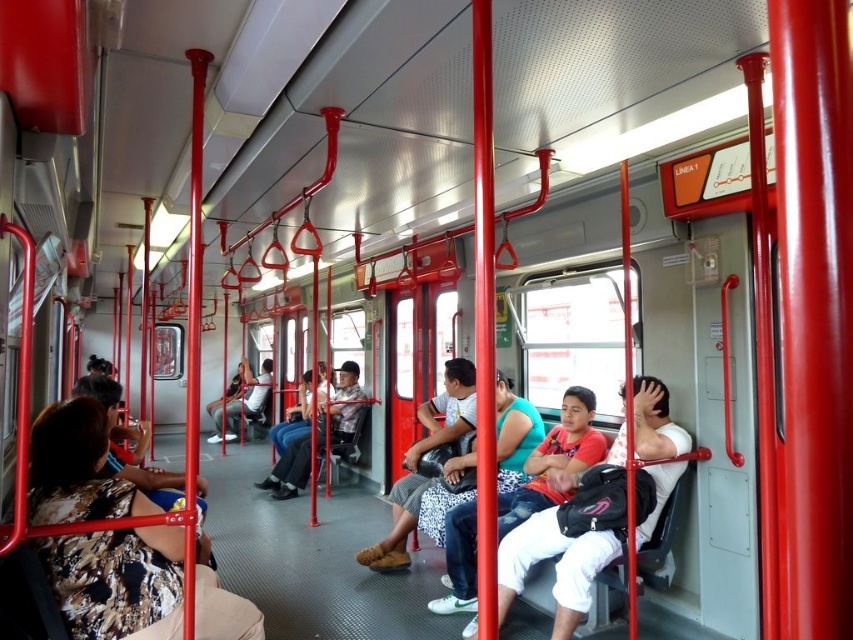
Question: Does matte red shirt at center appear over white cotton shirt at center?

Choices:
 (A) yes
 (B) no

Answer: (A)

Question: Is floral fabric shirt at left closer to camera compared to white cotton shirt at center?

Choices:
 (A) yes
 (B) no

Answer: (A)

Question: Estimate the real-world distances between objects in this image. Which object is closer to the floral fabric shirt at left?

Choices:
 (A) matte red shirt at center
 (B) white cotton shirt at center

Answer: (A)

Question: Which of the following is the closest to the observer?

Choices:
 (A) (595, 548)
 (B) (102, 412)
 (C) (602, 456)

Answer: (B)

Question: Can you confirm if matte red shirt at center is positioned below white cotton shirt at center?

Choices:
 (A) no
 (B) yes

Answer: (A)

Question: Based on their relative distances, which object is nearer to the floral fabric shirt at left?

Choices:
 (A) matte red shirt at center
 (B) white cotton shirt at center

Answer: (A)